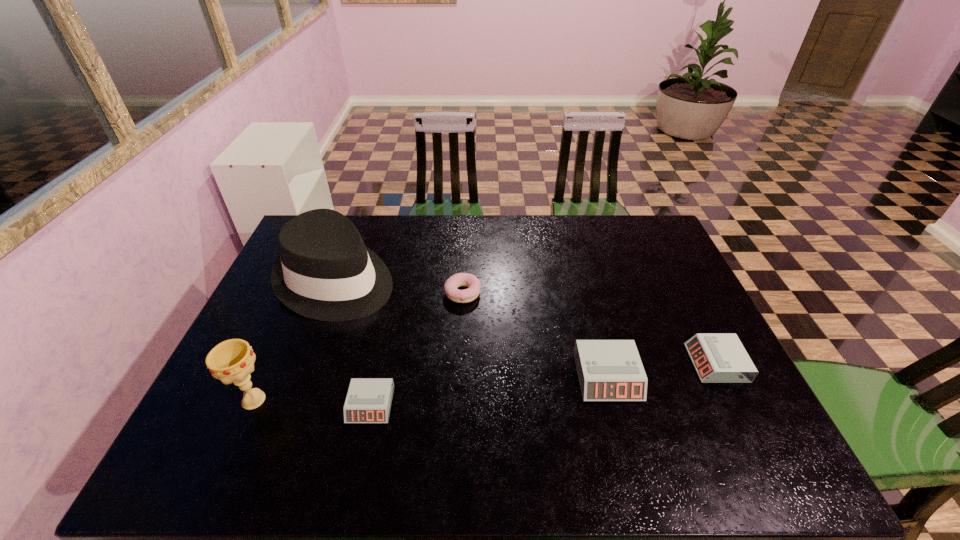
Locate an element on the screen. blank region between the doughnut and the fifth object from left to right is located at coordinates (535, 334).

What are the coordinates of `vacant region between the fedora and the fourth shortest object` in the screenshot? It's located at (472, 328).

The height and width of the screenshot is (540, 960). Find the location of `unoccupied area between the rightmost alarm clock and the shortest alarm clock`. unoccupied area between the rightmost alarm clock and the shortest alarm clock is located at coordinates (543, 384).

Find the location of a particular element. This screenshot has width=960, height=540. free point between the rightmost alarm clock and the chalice is located at coordinates (485, 382).

At what (x,y) coordinates should I click in order to perform the action: click on free space between the doughnut and the shortest object. Please return your answer as a coordinate pair (x, y). This screenshot has height=540, width=960. Looking at the image, I should click on (417, 349).

The width and height of the screenshot is (960, 540). Find the location of `blank region between the fedora and the second alarm clock from right to left`. blank region between the fedora and the second alarm clock from right to left is located at coordinates (472, 328).

I want to click on the fifth closest object to the second alarm clock from right to left, so click(232, 361).

This screenshot has height=540, width=960. I want to click on object that is the fifth nearest to the chalice, so click(x=717, y=357).

Identify which alarm clock is the second nearest to the doughnut. Please provide its 2D coordinates. Your answer should be formatted as a tuple, i.e. [(x, y)], where the tuple contains the x and y coordinates of a point satisfying the conditions above.

[(368, 400)]

This screenshot has width=960, height=540. Find the location of `alarm clock that is the closest to the shortest object`. alarm clock that is the closest to the shortest object is located at coordinates (608, 370).